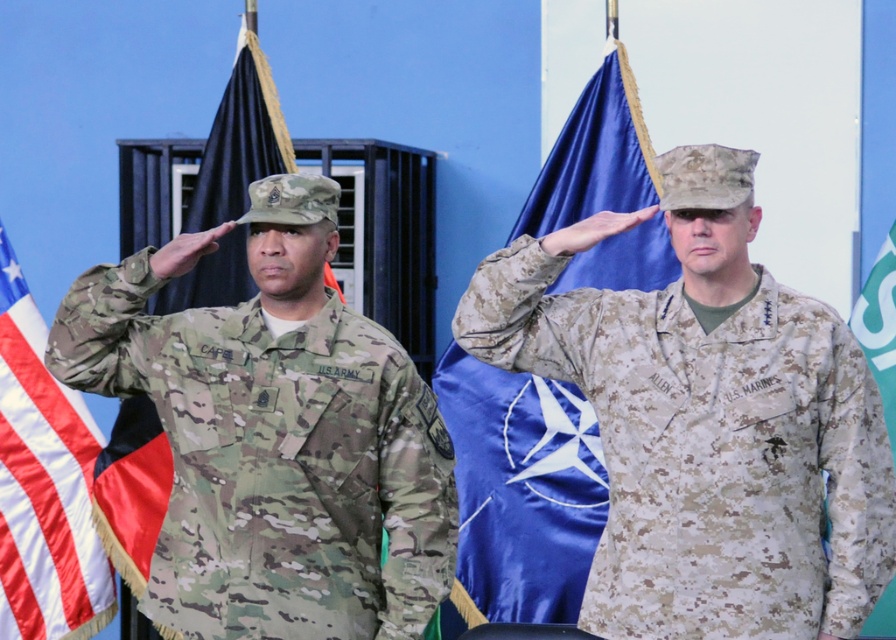
You are an observer standing in front of the two individuals. Which object is positioned lower between the multicam uniform at left and the camouflage fabric flag at right?

The multicam uniform at left is below the camouflage fabric flag at right, so the multicam uniform at left is positioned lower.

You are standing in front of a military ceremony scene. You see a point at coordinates (519, 493). Based on the scene description, what object is located at that point?

The point at coordinates (519, 493) corresponds to the blue satin flag at center.